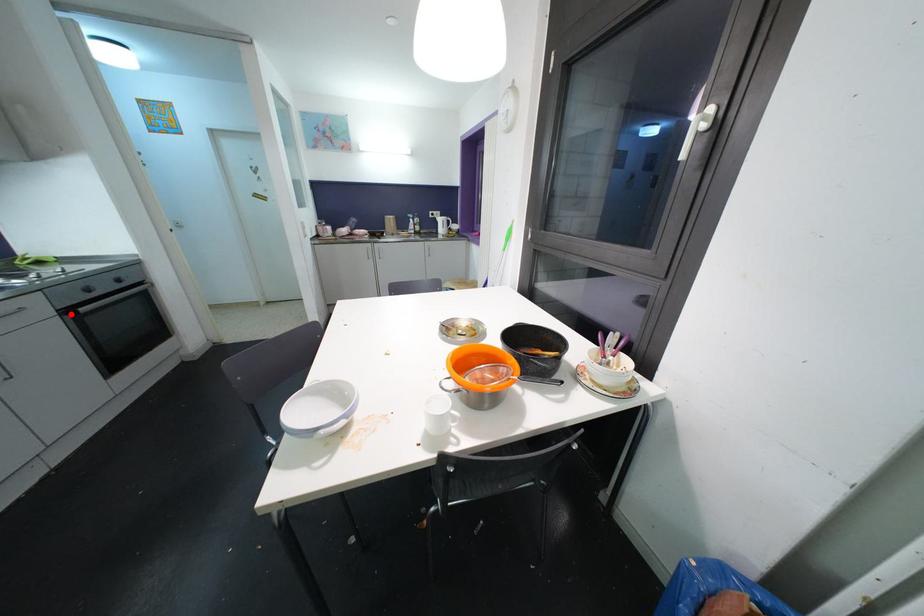
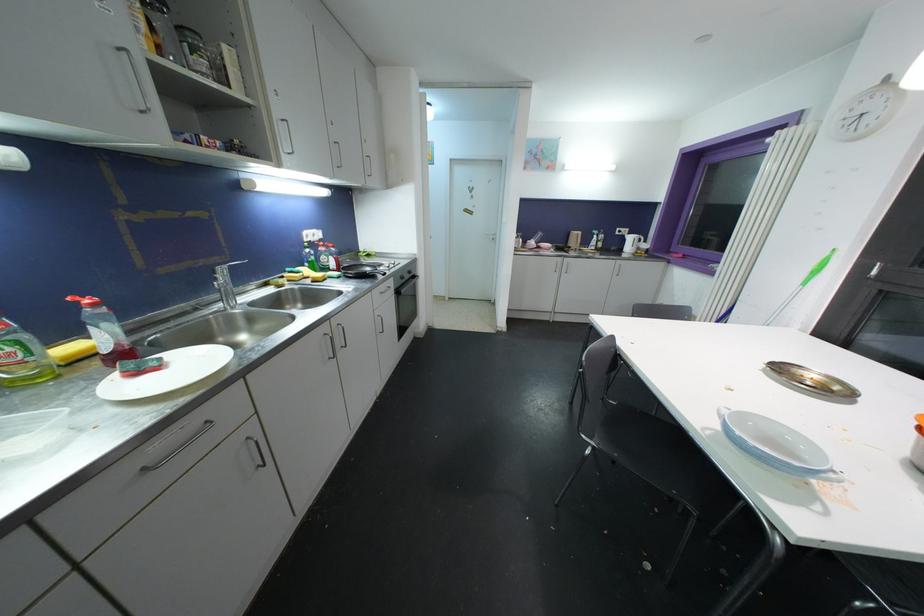
Locate, in the second image, the point that corresponds to the highlighted location in the first image.

(400, 294)